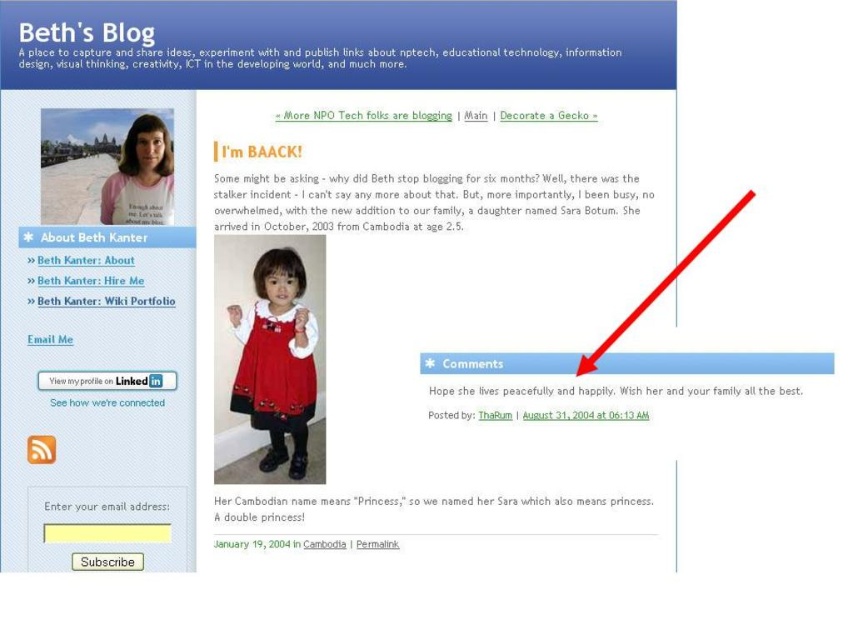
Can you confirm if red velvet dress at center is positioned to the right of matte white dress at upper left?

Yes, red velvet dress at center is to the right of matte white dress at upper left.

Based on the photo, does red velvet dress at center have a lesser width compared to matte white dress at upper left?

No, red velvet dress at center is not thinner than matte white dress at upper left.

From the picture: Who is more distant from viewer, (310,385) or (103,182)?

Point (310,385)

Where is `red velvet dress at center`? The width and height of the screenshot is (853, 640). red velvet dress at center is located at coordinates (273, 378).